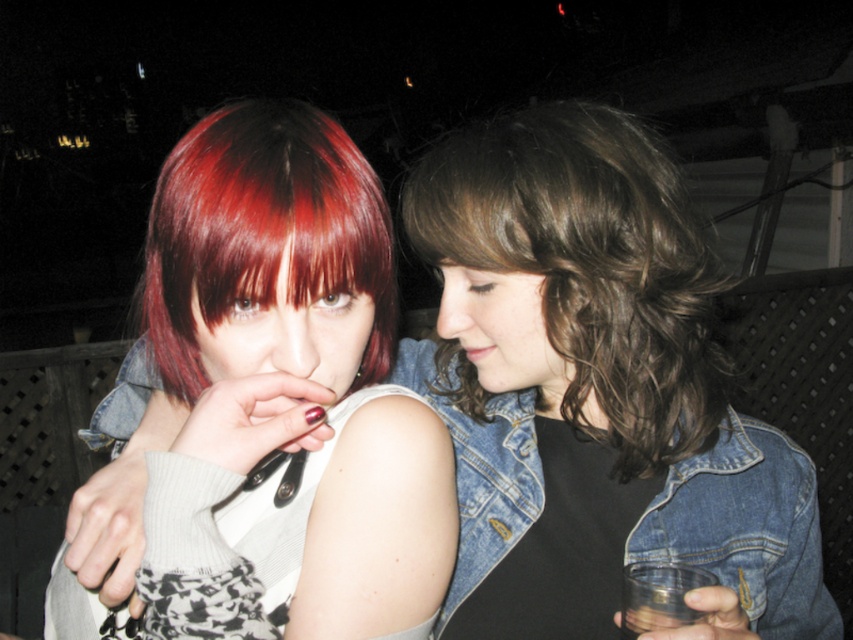
Question: Based on their relative distances, which object is farther from the transparent plastic cup at lower right?

Choices:
 (A) shiny red hair at center
 (B) matte red hair at center
 (C) brown wavy hair at center

Answer: (A)

Question: Considering the real-world distances, which object is closest to the matte red hair at center?

Choices:
 (A) shiny red hair at center
 (B) transparent plastic cup at lower right

Answer: (A)

Question: Does brown wavy hair at center appear on the left side of shiny red hair at center?

Choices:
 (A) yes
 (B) no

Answer: (B)

Question: Which of these objects is positioned closest to the shiny red hair at center?

Choices:
 (A) matte red hair at center
 (B) brown wavy hair at center
 (C) transparent plastic cup at lower right

Answer: (A)

Question: Is brown wavy hair at center to the right of shiny red hair at center from the viewer's perspective?

Choices:
 (A) yes
 (B) no

Answer: (A)

Question: Does brown wavy hair at center appear over transparent plastic cup at lower right?

Choices:
 (A) no
 (B) yes

Answer: (B)